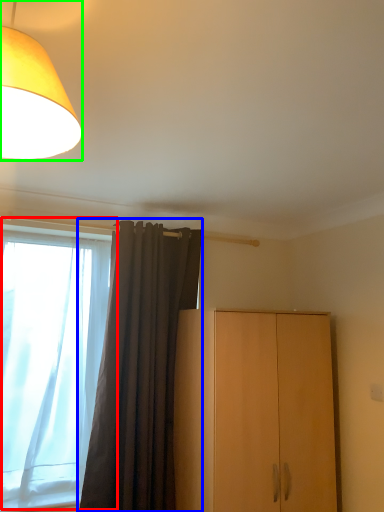
Question: Estimate the real-world distances between objects in this image. Which object is closer to window (highlighted by a red box), curtain (highlighted by a blue box) or lamp (highlighted by a green box)?

Choices:
 (A) curtain
 (B) lamp

Answer: (A)